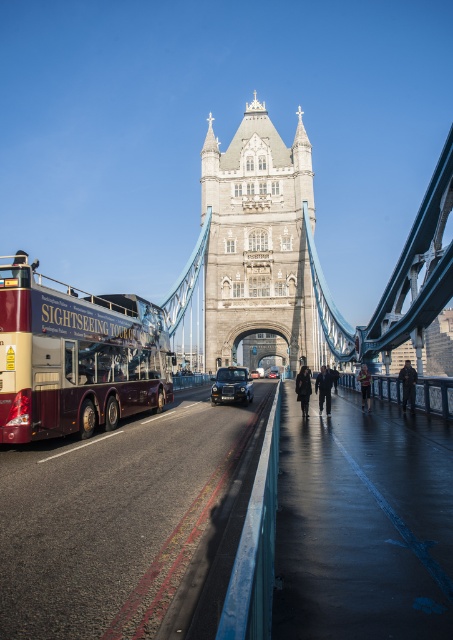
You are standing at the camera position observing the Tower Bridge scene. There is a specific point marked at coordinates point (x=303, y=342). Considering the distance from your current position, can you safely walk to that point without needing to move more than 400 feet?

The point (x=303, y=342) is 385.07 feet away from the camera, so yes, you can safely walk to that point without exceeding 400 feet since 385.07 is less than 400.

You are standing at the center of the road in front of the Tower Bridge. There is a red double decker bus on the left side of the road. You see a dark blue jacket at right represented by point (408,385). Which direction should you walk to reach the dark blue jacket at right without crossing the road?

The dark blue jacket at right is located at point (408,385), which is on the right side of the road. Since you are standing at the center of the road, you should walk towards the right side of the road to reach the dark blue jacket at right without crossing the road.

You are a photographer planning to capture both the stone gothic tower at center and the shiny black car at center in a single frame. Based on their sizes, which object should you position closer to the camera to ensure both fit well in the photo?

The stone gothic tower at center is wider than the shiny black car at center, so to fit both in the frame, position the shiny black car at center closer to the camera since it is narrower and requires less space.